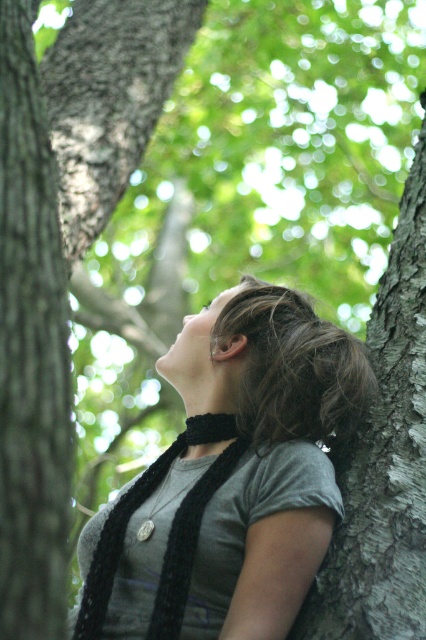
Can you confirm if smooth brown bark at left is positioned above dark brown hair at center?

Indeed, smooth brown bark at left is positioned over dark brown hair at center.

Who is positioned more to the right, smooth brown bark at left or dark brown hair at center?

Positioned to the right is dark brown hair at center.

Find the location of a particular element. The width and height of the screenshot is (426, 640). smooth brown bark at left is located at coordinates (31, 349).

Locate an element on the screen. smooth brown bark at left is located at coordinates (31, 349).

Between smooth brown bark at left and dark gray bark at right, which one appears on the right side from the viewer's perspective?

From the viewer's perspective, dark gray bark at right appears more on the right side.

Who is shorter, smooth brown bark at left or dark gray bark at right?

smooth brown bark at left

In order to click on smooth brown bark at left in this screenshot , I will do `click(31, 349)`.

Locate an element on the screen. This screenshot has height=640, width=426. smooth brown bark at left is located at coordinates (31, 349).

Is point (258, 305) more distant than point (3, 426)?

Yes, it is behind point (3, 426).

Which is behind, point (285, 426) or point (25, 97)?

Positioned behind is point (285, 426).

Between point (301, 481) and point (2, 540), which one is positioned behind?

The point (301, 481) is behind.

You are a GUI agent. You are given a task and a screenshot of the screen. Output one action in this format:
    pyautogui.click(x=<x>, y=<y>)
    Task: Click on the black knitted scarf at center
    
    Given the screenshot: What is the action you would take?
    pyautogui.click(x=235, y=474)